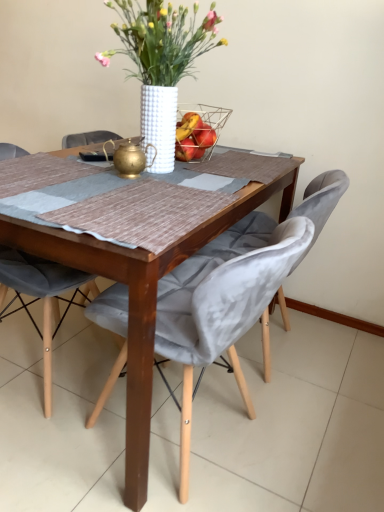
Question: Is wooden table at center at the right side of velvet grey chair at center, the 1th chair positioned from the right?

Choices:
 (A) yes
 (B) no

Answer: (B)

Question: From a real-world perspective, is wooden table at center positioned over velvet grey chair at center, acting as the 2th chair starting from the left, based on gravity?

Choices:
 (A) yes
 (B) no

Answer: (A)

Question: Is wooden table at center outside of velvet grey chair at center, acting as the 2th chair starting from the left?

Choices:
 (A) yes
 (B) no

Answer: (A)

Question: From a real-world perspective, does wooden table at center sit lower than velvet grey chair at center, the 1th chair positioned from the right?

Choices:
 (A) no
 (B) yes

Answer: (A)

Question: Considering the relative positions of wooden table at center and velvet grey chair at center, the 1th chair positioned from the right, in the image provided, is wooden table at center to the left of velvet grey chair at center, the 1th chair positioned from the right, from the viewer's perspective?

Choices:
 (A) yes
 (B) no

Answer: (A)

Question: Is the position of wooden table at center less distant than that of velvet grey chair at center, acting as the 2th chair starting from the left?

Choices:
 (A) yes
 (B) no

Answer: (A)

Question: Can you confirm if wooden table at center is positioned to the left of wire mesh basket at center?

Choices:
 (A) no
 (B) yes

Answer: (B)

Question: Does wooden table at center have a smaller size compared to wire mesh basket at center?

Choices:
 (A) yes
 (B) no

Answer: (B)

Question: Is wooden table at center bigger than wire mesh basket at center?

Choices:
 (A) yes
 (B) no

Answer: (A)

Question: From a real-world perspective, is wooden table at center physically below wire mesh basket at center?

Choices:
 (A) yes
 (B) no

Answer: (A)

Question: From the image's perspective, does wooden table at center appear higher than wire mesh basket at center?

Choices:
 (A) yes
 (B) no

Answer: (B)

Question: Would you say wooden table at center is outside wire mesh basket at center?

Choices:
 (A) no
 (B) yes

Answer: (B)

Question: Considering the relative sizes of wire mesh basket at center and wooden table at center in the image provided, is wire mesh basket at center thinner than wooden table at center?

Choices:
 (A) yes
 (B) no

Answer: (A)